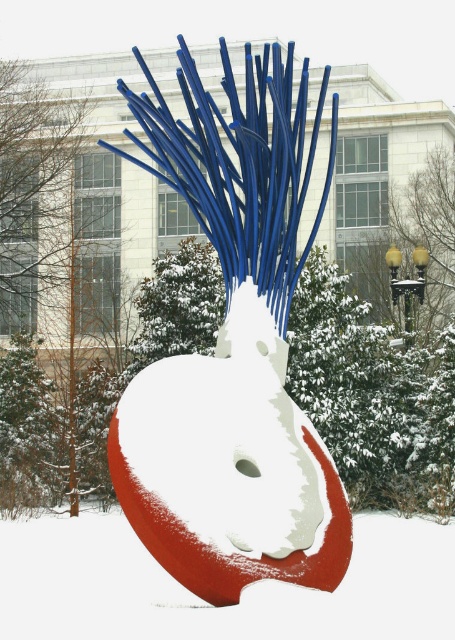
Question: Does smooth glossy sculpture at center appear over smooth red sculpture at center?

Choices:
 (A) yes
 (B) no

Answer: (A)

Question: Does smooth glossy sculpture at center lie in front of smooth red sculpture at center?

Choices:
 (A) yes
 (B) no

Answer: (B)

Question: Which point is farther to the camera?

Choices:
 (A) smooth glossy sculpture at center
 (B) smooth red sculpture at center

Answer: (A)

Question: Which object appears closest to the camera in this image?

Choices:
 (A) smooth glossy sculpture at center
 (B) smooth red sculpture at center

Answer: (B)

Question: Is smooth glossy sculpture at center bigger than smooth red sculpture at center?

Choices:
 (A) no
 (B) yes

Answer: (B)

Question: Which point is closer to the camera taking this photo?

Choices:
 (A) (171, 621)
 (B) (182, 424)

Answer: (A)